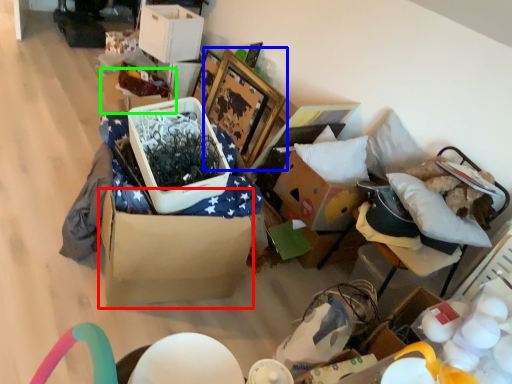
Question: Which is nearer to the cardboard box (highlighted by a red box)? picture frame (highlighted by a blue box) or storage box (highlighted by a green box).

Choices:
 (A) picture frame
 (B) storage box

Answer: (A)